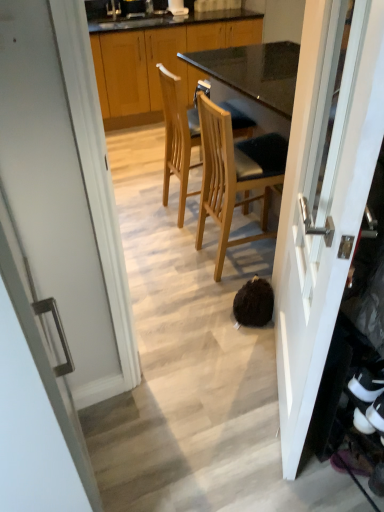
Question: Is wooden cabinets at center to the left of white glossy door at center, the first door when ordered from left to right, from the viewer's perspective?

Choices:
 (A) no
 (B) yes

Answer: (A)

Question: Is wooden cabinets at center beside white glossy door at center, which ranks as the 2th door in right-to-left order?

Choices:
 (A) no
 (B) yes

Answer: (A)

Question: Does wooden cabinets at center turn towards white glossy door at center, the first door when ordered from left to right?

Choices:
 (A) no
 (B) yes

Answer: (B)

Question: From the image's perspective, is wooden cabinets at center located above white glossy door at center, which ranks as the 2th door in right-to-left order?

Choices:
 (A) yes
 (B) no

Answer: (A)

Question: From a real-world perspective, is wooden cabinets at center positioned over white glossy door at center, which ranks as the 2th door in right-to-left order, based on gravity?

Choices:
 (A) yes
 (B) no

Answer: (B)

Question: Is light brown wood chair at center, arranged as the second chair when viewed from the front, wider or thinner than wooden cabinets at center?

Choices:
 (A) thin
 (B) wide

Answer: (A)

Question: Considering the positions of light brown wood chair at center, arranged as the second chair when viewed from the front, and wooden cabinets at center in the image, is light brown wood chair at center, arranged as the second chair when viewed from the front, taller or shorter than wooden cabinets at center?

Choices:
 (A) tall
 (B) short

Answer: (B)

Question: From the image's perspective, is light brown wood chair at center, which appears as the 1th chair when viewed from the back, positioned above or below wooden cabinets at center?

Choices:
 (A) below
 (B) above

Answer: (A)

Question: Is light brown wood chair at center, arranged as the second chair when viewed from the front, in front of or behind wooden cabinets at center in the image?

Choices:
 (A) front
 (B) behind

Answer: (A)

Question: Is white glossy door at center, which ranks as the 1th door in right-to-left order, situated inside wooden cabinets at center or outside?

Choices:
 (A) inside
 (B) outside

Answer: (B)

Question: In the image, is white glossy door at center, which is counted as the 2th door, starting from the left, on the left side or the right side of wooden cabinets at center?

Choices:
 (A) right
 (B) left

Answer: (A)

Question: In the image, is white glossy door at center, which is counted as the 2th door, starting from the left, positioned in front of or behind wooden cabinets at center?

Choices:
 (A) front
 (B) behind

Answer: (A)

Question: Is white glossy door at center, which ranks as the 1th door in right-to-left order, bigger or smaller than wooden cabinets at center?

Choices:
 (A) big
 (B) small

Answer: (B)

Question: From a real-world perspective, is light brown wood chair at center, arranged as the second chair when viewed from the front, positioned above or below white glossy door at center, which is counted as the 2th door, starting from the left?

Choices:
 (A) below
 (B) above

Answer: (A)

Question: From the image's perspective, is light brown wood chair at center, which appears as the 1th chair when viewed from the back, above or below white glossy door at center, which is counted as the 2th door, starting from the left?

Choices:
 (A) below
 (B) above

Answer: (B)